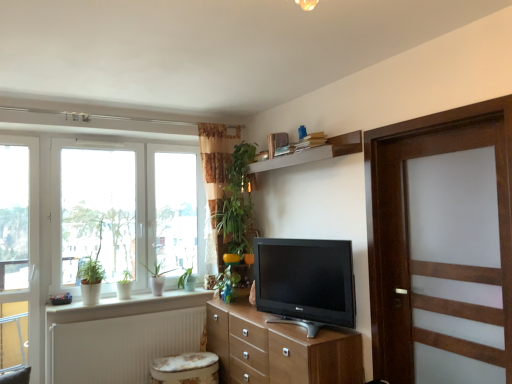
Image resolution: width=512 pixels, height=384 pixels. In order to click on empty space that is ontop of white textured radiator at lower left (from a real-world perspective) in this screenshot , I will do `click(120, 312)`.